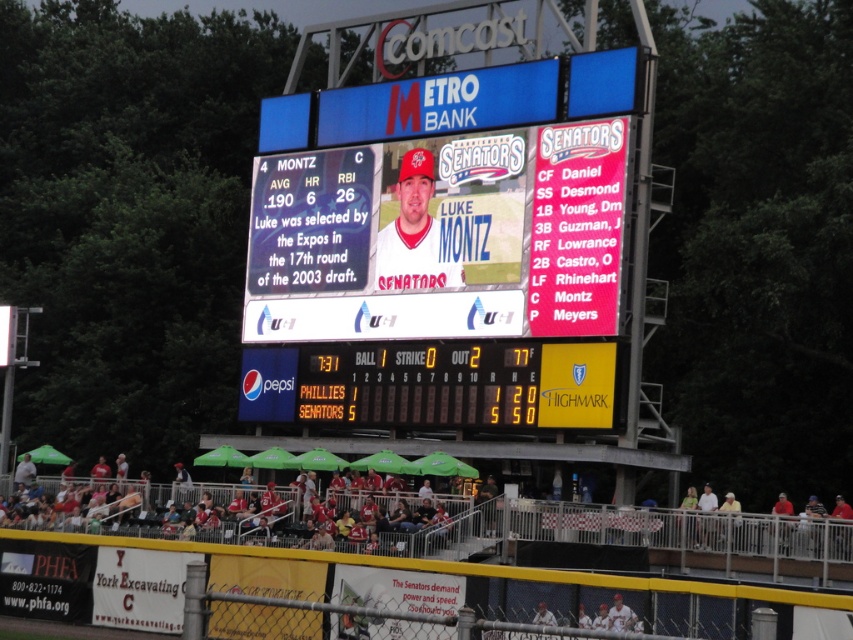
Which of these two, matte plastic scoreboard at center or red fabric seats at lower center, stands shorter?

With less height is red fabric seats at lower center.

Consider the image. Does matte plastic scoreboard at center have a larger size compared to red fabric seats at lower center?

Correct, matte plastic scoreboard at center is larger in size than red fabric seats at lower center.

What do you see at coordinates (444, 214) in the screenshot? The width and height of the screenshot is (853, 640). I see `matte plastic scoreboard at center` at bounding box center [444, 214].

Where is `matte plastic scoreboard at center`? The image size is (853, 640). matte plastic scoreboard at center is located at coordinates (444, 214).